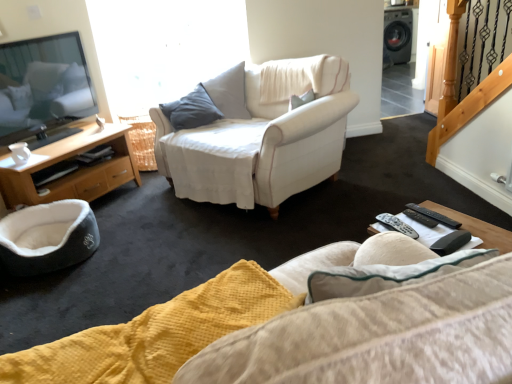
Question: Considering the relative sizes of wooden cabinet at left and black plastic remote at lower right, marked as the second remote in a left-to-right arrangement, in the image provided, is wooden cabinet at left bigger than black plastic remote at lower right, marked as the second remote in a left-to-right arrangement,?

Choices:
 (A) no
 (B) yes

Answer: (B)

Question: Does wooden cabinet at left appear on the left side of black plastic remote at lower right, the 2th remote viewed from the right?

Choices:
 (A) no
 (B) yes

Answer: (B)

Question: Does wooden cabinet at left appear on the right side of black plastic remote at lower right, marked as the second remote in a left-to-right arrangement?

Choices:
 (A) yes
 (B) no

Answer: (B)

Question: Can you confirm if wooden cabinet at left is wider than black plastic remote at lower right, the 2th remote viewed from the right?

Choices:
 (A) no
 (B) yes

Answer: (B)

Question: Are wooden cabinet at left and black plastic remote at lower right, marked as the second remote in a left-to-right arrangement, far apart?

Choices:
 (A) no
 (B) yes

Answer: (B)

Question: Considering the relative positions of wooden cabinet at left and black plastic remote at lower right, marked as the second remote in a left-to-right arrangement, in the image provided, is wooden cabinet at left behind black plastic remote at lower right, marked as the second remote in a left-to-right arrangement,?

Choices:
 (A) yes
 (B) no

Answer: (A)

Question: Is black plastic remote at lower right, the 1th remote when ordered from left to right, positioned far away from yellow textured fabric studio couch at lower center?

Choices:
 (A) yes
 (B) no

Answer: (B)

Question: Is black plastic remote at lower right, the 1th remote when ordered from left to right, looking in the opposite direction of yellow textured fabric studio couch at lower center?

Choices:
 (A) yes
 (B) no

Answer: (B)

Question: Is black plastic remote at lower right, positioned as the third remote in right-to-left order, taller than yellow textured fabric studio couch at lower center?

Choices:
 (A) yes
 (B) no

Answer: (B)

Question: From the image's perspective, does black plastic remote at lower right, the 1th remote when ordered from left to right, appear lower than yellow textured fabric studio couch at lower center?

Choices:
 (A) yes
 (B) no

Answer: (B)

Question: Is black plastic remote at lower right, positioned as the third remote in right-to-left order, thinner than yellow textured fabric studio couch at lower center?

Choices:
 (A) no
 (B) yes

Answer: (B)

Question: From a real-world perspective, does black plastic remote at lower right, the 1th remote when ordered from left to right, sit lower than yellow textured fabric studio couch at lower center?

Choices:
 (A) yes
 (B) no

Answer: (A)

Question: From the image's perspective, is wooden cabinet at left located above black plastic remote control at lower right?

Choices:
 (A) no
 (B) yes

Answer: (B)